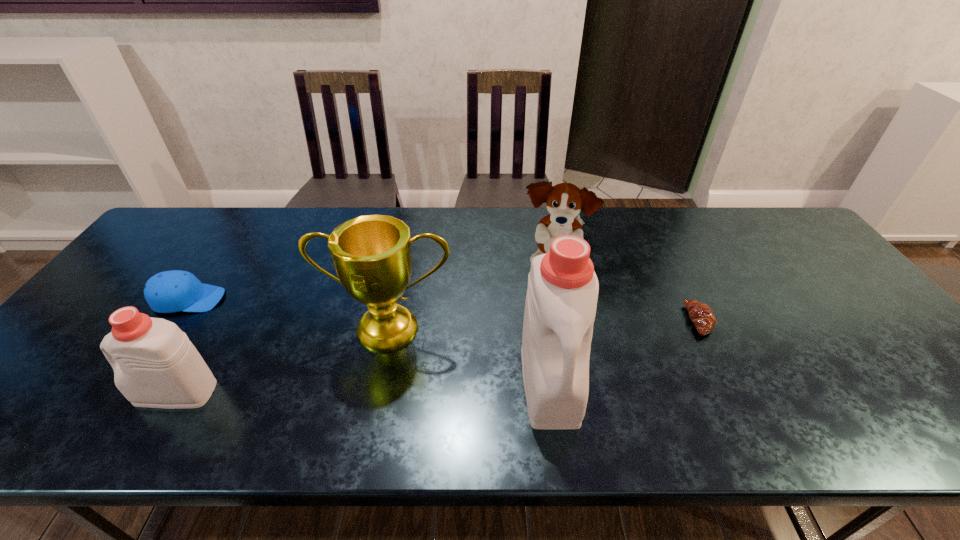
This screenshot has width=960, height=540. I want to click on the second closest object to the cap, so click(x=371, y=254).

Select which object appears as the third closest to the puppy. Please provide its 2D coordinates. Your answer should be formatted as a tuple, i.e. [(x, y)], where the tuple contains the x and y coordinates of a point satisfying the conditions above.

[(701, 314)]

Where is `vacant space that satisfies the following two spatial constraints: 1. on the front-facing side of the rightmost object; 2. on the right side of the cap`? The width and height of the screenshot is (960, 540). vacant space that satisfies the following two spatial constraints: 1. on the front-facing side of the rightmost object; 2. on the right side of the cap is located at coordinates (174, 320).

Where is `vacant space that satisfies the following two spatial constraints: 1. on the face of the puppy; 2. on the handle side of the shorter detergent`? The width and height of the screenshot is (960, 540). vacant space that satisfies the following two spatial constraints: 1. on the face of the puppy; 2. on the handle side of the shorter detergent is located at coordinates [578, 393].

Locate an element on the screen. free spot that satisfies the following two spatial constraints: 1. on the shiny surface of the third object from left to right; 2. on the handle side of the shorter detergent is located at coordinates (376, 393).

Identify the location of blank space that satisfies the following two spatial constraints: 1. on the handle side of the taller detergent; 2. on the handle side of the left detergent. This screenshot has width=960, height=540. (551, 393).

The height and width of the screenshot is (540, 960). What are the coordinates of `vacant space that satisfies the following two spatial constraints: 1. on the face of the puppy; 2. on the handle side of the shorter detergent` in the screenshot? It's located at (578, 393).

At what (x,y) coordinates should I click in order to perform the action: click on free location that satisfies the following two spatial constraints: 1. on the face of the shortest object; 2. on the left side of the puppy. Please return your answer as a coordinate pair (x, y). This screenshot has width=960, height=540. Looking at the image, I should click on (564, 320).